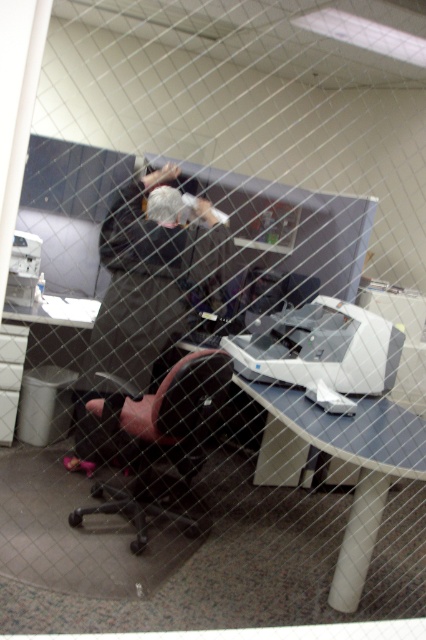
Question: Which of the following is the closest to the observer?

Choices:
 (A) pyautogui.click(x=356, y=484)
 (B) pyautogui.click(x=183, y=474)
 (C) pyautogui.click(x=92, y=362)

Answer: (B)

Question: Which point appears closest to the camera in this image?

Choices:
 (A) (365, 499)
 (B) (196, 410)

Answer: (A)

Question: Is dark gray coat at center positioned at the back of black leather swivel chair at center?

Choices:
 (A) yes
 (B) no

Answer: (A)

Question: Is white plastic printer at center positioned at the back of black leather swivel chair at center?

Choices:
 (A) no
 (B) yes

Answer: (A)

Question: Does white plastic printer at center have a greater width compared to black leather swivel chair at center?

Choices:
 (A) yes
 (B) no

Answer: (A)

Question: Which point is farther to the camera?

Choices:
 (A) dark gray coat at center
 (B) black leather swivel chair at center
 (C) white plastic printer at center

Answer: (A)